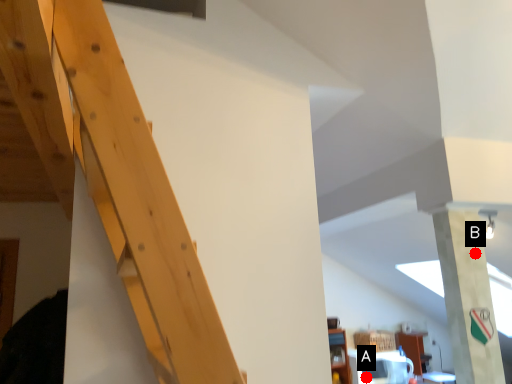
Question: Two points are circled on the image, labeled by A and B beside each circle. Which point is farther to the camera?

Choices:
 (A) A is further
 (B) B is further

Answer: (A)